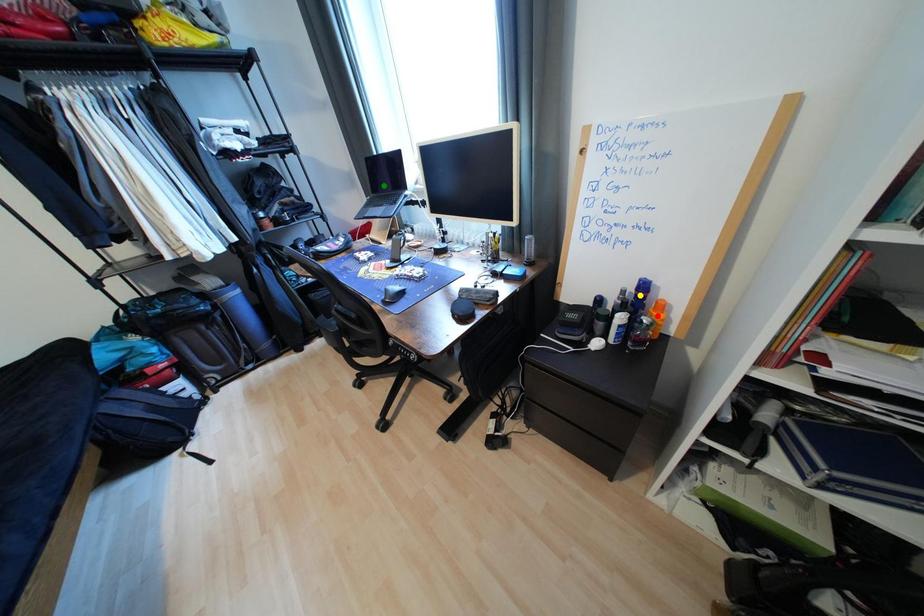
Order these from farthest to nearest:
- red point
- green point
- yellow point

green point < yellow point < red point